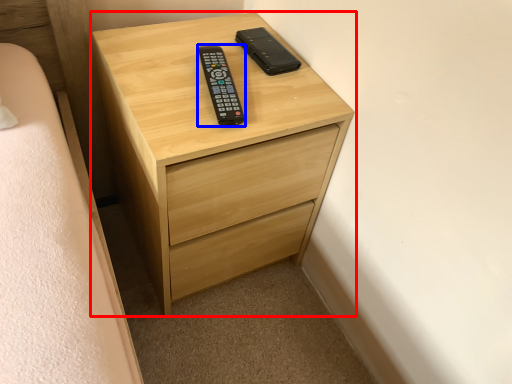
Question: Which object appears farthest to the camera in this image, chest of drawers (highlighted by a red box) or control (highlighted by a blue box)?

Choices:
 (A) chest of drawers
 (B) control

Answer: (B)